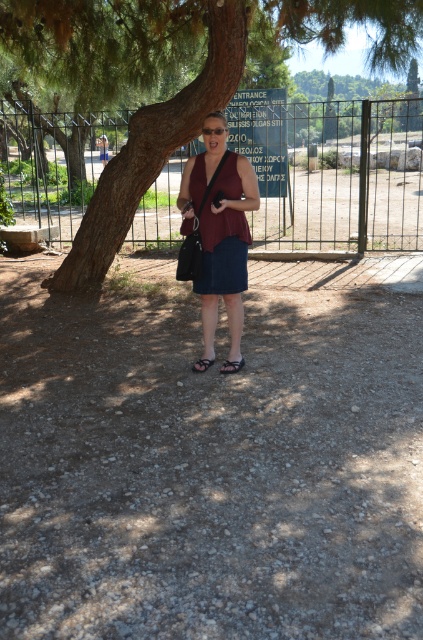
Can you confirm if green leafy tree at center is taller than matte red blouse at center?

Incorrect, green leafy tree at center's height is not larger of matte red blouse at center's.

What do you see at coordinates (140, 106) in the screenshot?
I see `green leafy tree at center` at bounding box center [140, 106].

At what (x,y) coordinates should I click in order to perform the action: click on green leafy tree at center. Please return your answer as a coordinate pair (x, y). The width and height of the screenshot is (423, 640). Looking at the image, I should click on (140, 106).

Consider the image. Does black leather sandal at lower center appear on the right side of black rubber sandal at lower center?

Yes, black leather sandal at lower center is to the right of black rubber sandal at lower center.

Does black leather sandal at lower center appear over black rubber sandal at lower center?

Incorrect, black leather sandal at lower center is not positioned above black rubber sandal at lower center.

Is point (239, 364) closer to viewer compared to point (203, 362)?

Yes, it is.

Find the location of `black leather sandal at lower center`. black leather sandal at lower center is located at coordinates (231, 365).

I want to click on matte red blouse at center, so click(x=219, y=227).

Is matte red blouse at center to the left of black rubber sandal at lower center from the viewer's perspective?

Incorrect, matte red blouse at center is not on the left side of black rubber sandal at lower center.

Locate an element on the screen. This screenshot has width=423, height=640. matte red blouse at center is located at coordinates (219, 227).

The image size is (423, 640). Identify the location of matte red blouse at center. (219, 227).